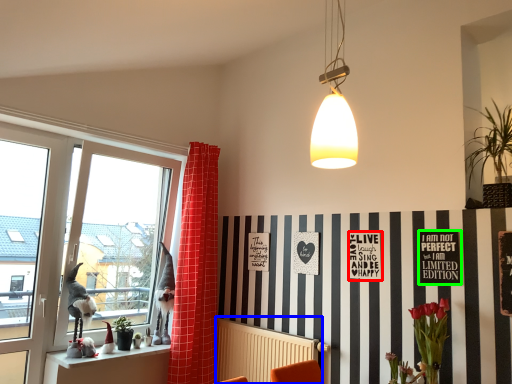
Question: Which object is the closest to the postcard (highlighted by a red box)? Choose among these: radiator (highlighted by a blue box) or bulletin board (highlighted by a green box).

Choices:
 (A) radiator
 (B) bulletin board

Answer: (B)